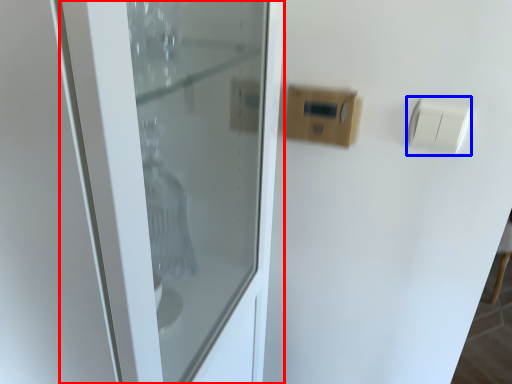
Question: Which object appears closest to the camera in this image, door (highlighted by a red box) or light switch (highlighted by a blue box)?

Choices:
 (A) door
 (B) light switch

Answer: (A)